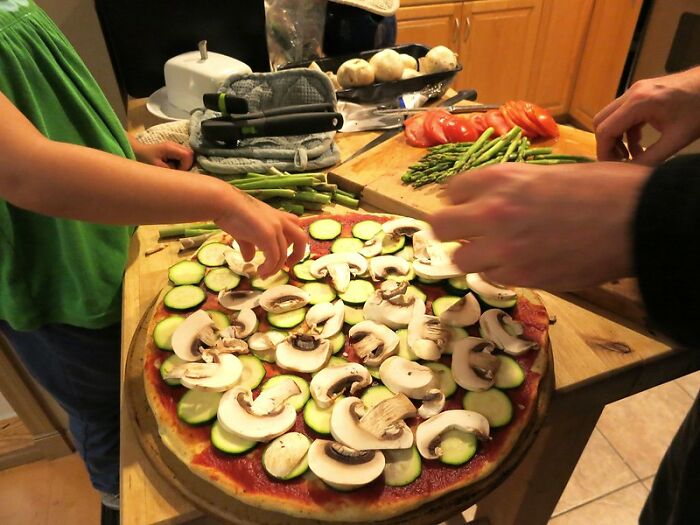
Where is `beige tiled floor`? beige tiled floor is located at coordinates (626, 472).